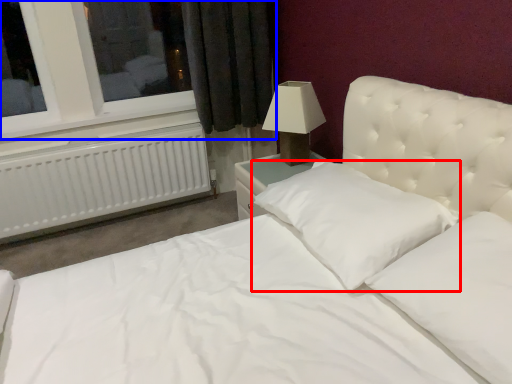
Question: Which object appears farthest to the camera in this image, pillow (highlighted by a red box) or window (highlighted by a blue box)?

Choices:
 (A) pillow
 (B) window

Answer: (B)